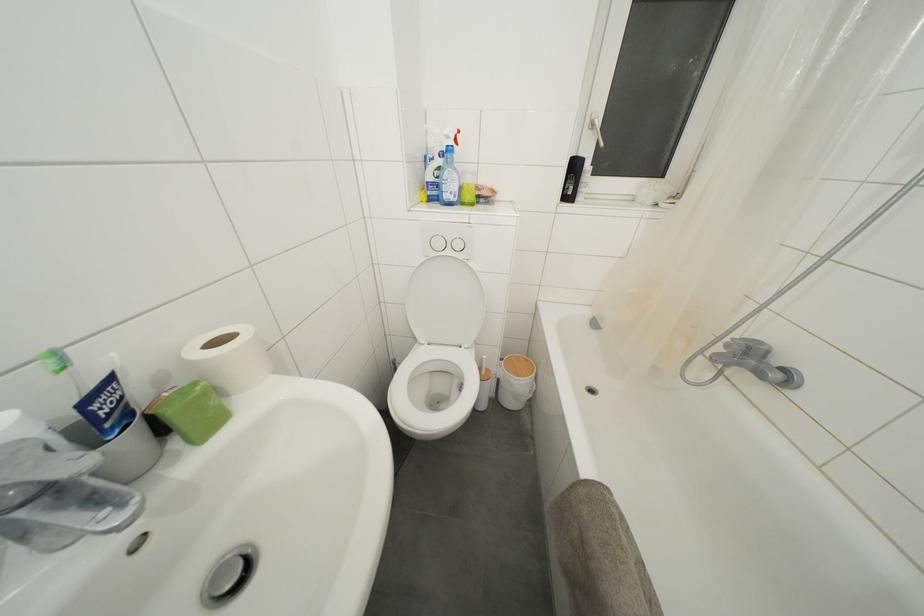
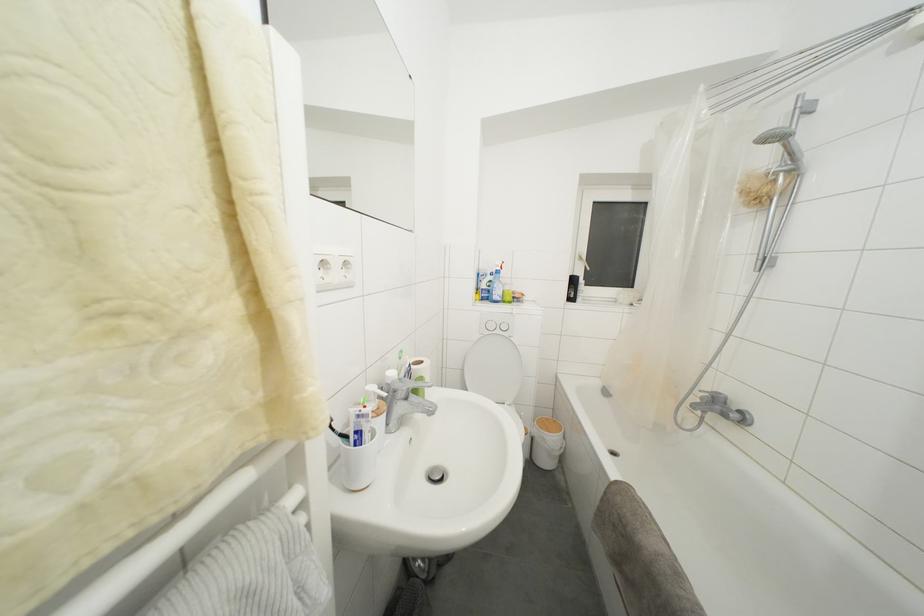
In the second image, find the point that corresponds to [521,362] in the first image.

(552, 424)